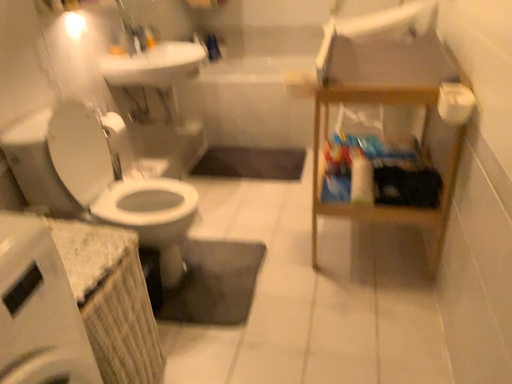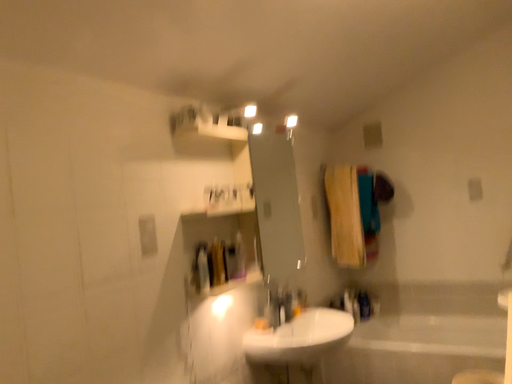
Question: Which way did the camera rotate in the video?

Choices:
 (A) rotated downward
 (B) rotated upward

Answer: (B)